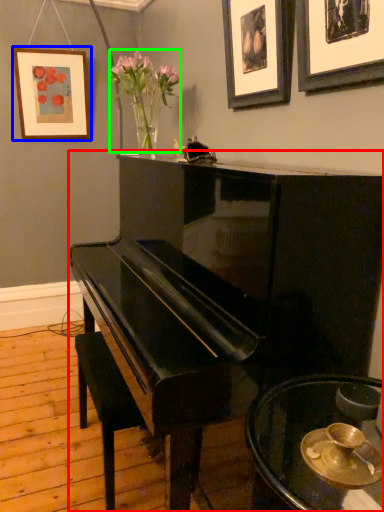
Question: Which object is the closest to the piano (highlighted by a red box)? Choose among these: picture frame (highlighted by a blue box) or floral arrangement (highlighted by a green box).

Choices:
 (A) picture frame
 (B) floral arrangement

Answer: (B)